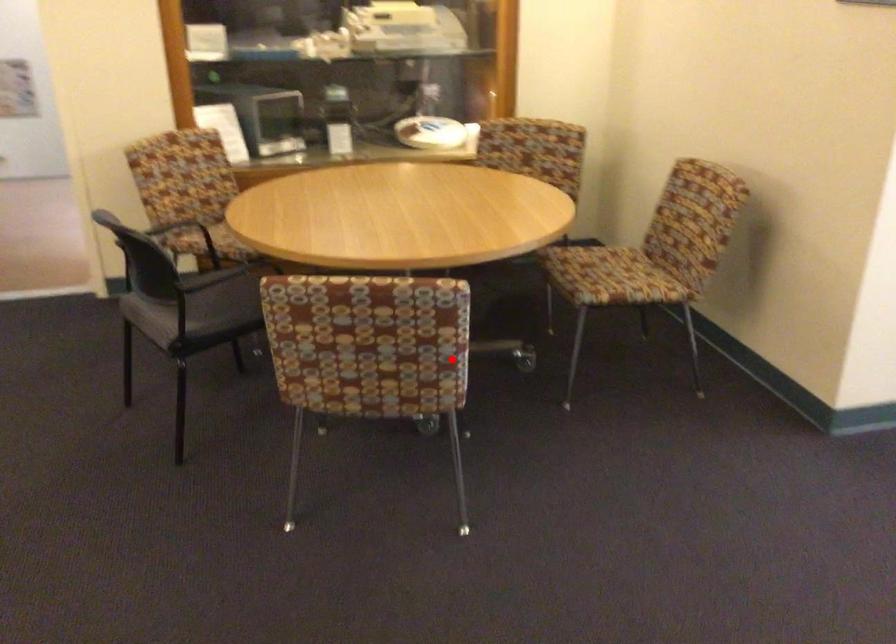
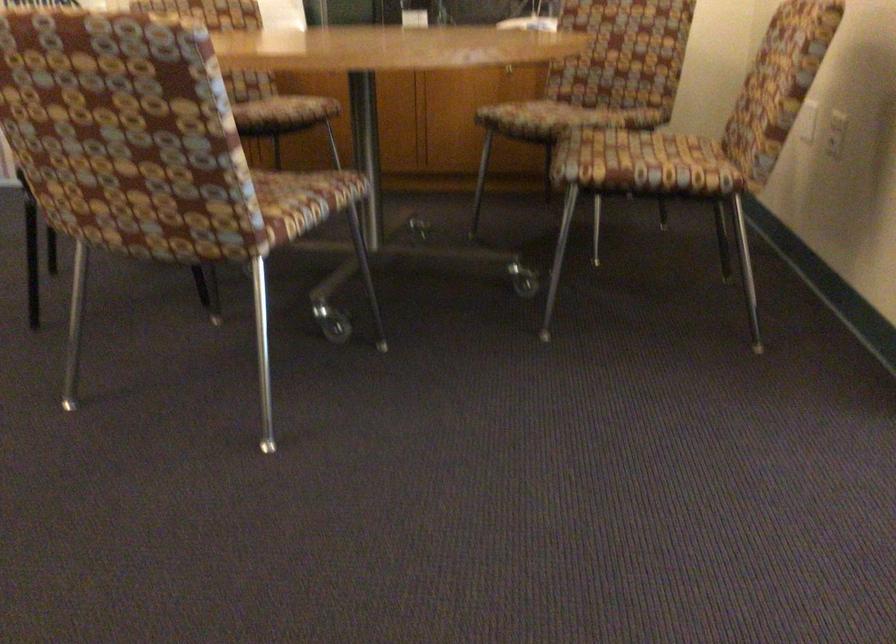
Question: I am providing you with two images of the same scene from different viewpoints. A red point is shown in image1. For the corresponding object point in image2, is it positioned nearer or farther from the camera?

Choices:
 (A) Nearer
 (B) Farther

Answer: (A)